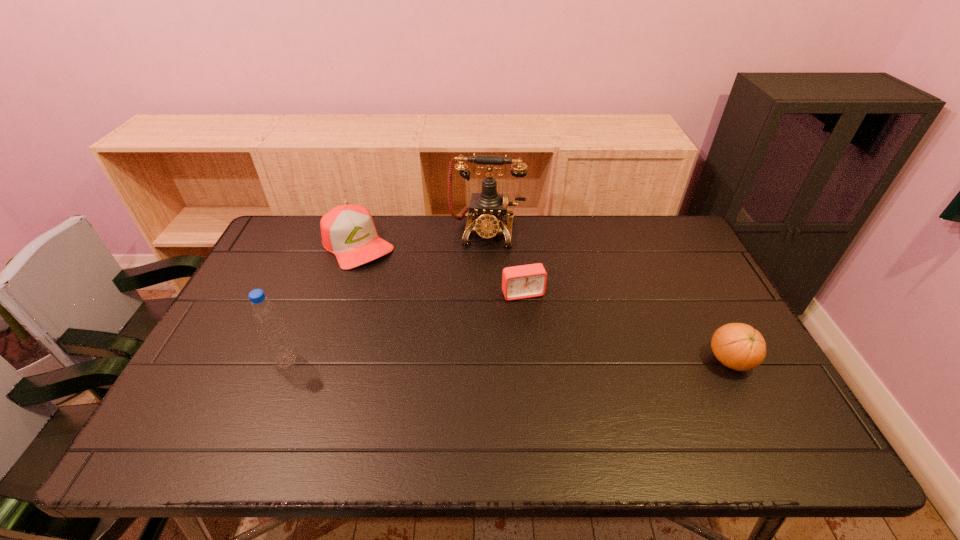
The image size is (960, 540). What are the coordinates of `unoccupied position between the tallest object and the rightmost object` in the screenshot? It's located at (609, 296).

Where is `free space between the alarm clock and the rightmost object`? free space between the alarm clock and the rightmost object is located at coordinates (626, 327).

Locate an element on the screen. This screenshot has height=540, width=960. free space that is in between the tallest object and the orange is located at coordinates (609, 296).

Where is `empty location between the baseball cap and the third nearest object`? The width and height of the screenshot is (960, 540). empty location between the baseball cap and the third nearest object is located at coordinates (441, 269).

You are a GUI agent. You are given a task and a screenshot of the screen. Output one action in this format:
    pyautogui.click(x=<x>, y=<y>)
    Task: Click on the vacant space that's between the third nearest object and the tallest object
    The image size is (960, 540).
    Given the screenshot: What is the action you would take?
    [505, 263]

At what (x,y) coordinates should I click in order to perform the action: click on empty space that is in between the orange and the tallest object. Please return your answer as a coordinate pair (x, y). Looking at the image, I should click on (609, 296).

Find the location of `vacant area between the shortest object and the orange`. vacant area between the shortest object and the orange is located at coordinates (626, 327).

Locate which object ranks fourth in proximity to the telephone. Please provide its 2D coordinates. Your answer should be formatted as a tuple, i.e. [(x, y)], where the tuple contains the x and y coordinates of a point satisfying the conditions above.

[(738, 346)]

Select which object is the second closest to the baseball cap. Please provide its 2D coordinates. Your answer should be formatted as a tuple, i.e. [(x, y)], where the tuple contains the x and y coordinates of a point satisfying the conditions above.

[(266, 317)]

At what (x,y) coordinates should I click in order to perform the action: click on vacant region that satisfies the following two spatial constraints: 1. on the back side of the tallest object; 2. on the right side of the second tallest object. Please return your answer as a coordinate pair (x, y). The width and height of the screenshot is (960, 540). Looking at the image, I should click on (338, 232).